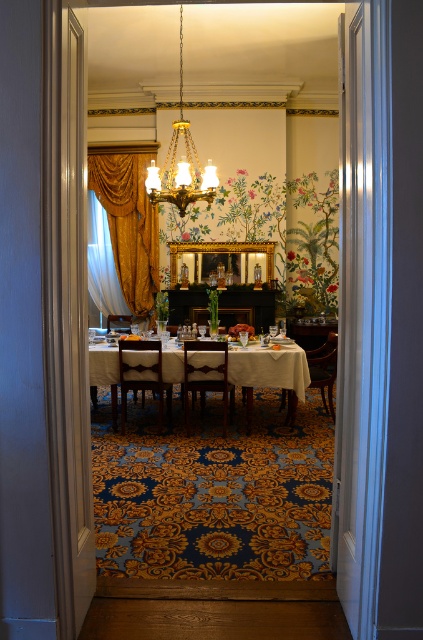
Question: Which of the following is the farthest from the observer?

Choices:
 (A) white clothed table at center
 (B) brown leather chair at center
 (C) gold metallic chandelier at upper center
 (D) white sheer curtain at left

Answer: (D)

Question: Does white clothed table at center have a smaller size compared to white sheer curtain at left?

Choices:
 (A) yes
 (B) no

Answer: (A)

Question: Which object is positioned farthest from the gold velvet curtain at left?

Choices:
 (A) wooden chair at center
 (B) brown leather chair at center
 (C) white sheer curtain at left

Answer: (B)

Question: Is gold metallic chandelier at upper center to the right of white sheer curtain at left from the viewer's perspective?

Choices:
 (A) no
 (B) yes

Answer: (B)

Question: Which point is farther to the camera?

Choices:
 (A) (90, 225)
 (B) (186, 413)

Answer: (A)

Question: Is wooden chair at center positioned before mahogany wood chair at right?

Choices:
 (A) no
 (B) yes

Answer: (B)